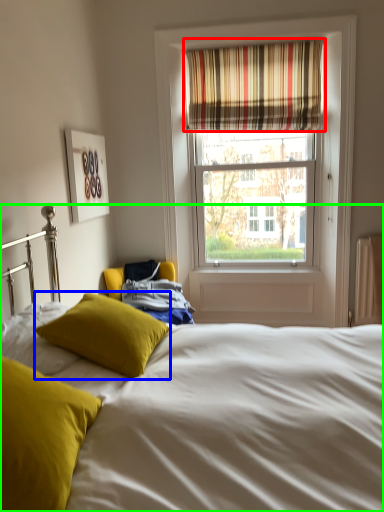
Question: Estimate the real-world distances between objects in this image. Which object is farther from curtain (highlighted by a red box), pillow (highlighted by a blue box) or bed (highlighted by a green box)?

Choices:
 (A) pillow
 (B) bed

Answer: (B)